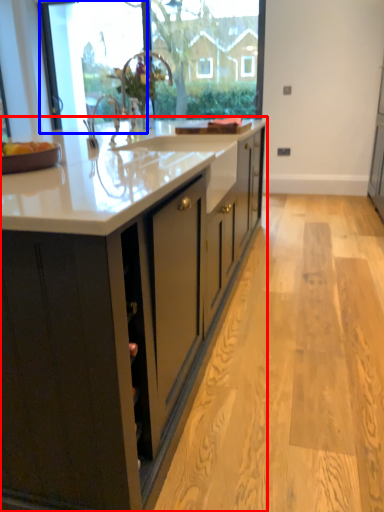
Question: Among these objects, which one is farthest to the camera, cabinetry (highlighted by a red box) or glass door (highlighted by a blue box)?

Choices:
 (A) cabinetry
 (B) glass door

Answer: (B)